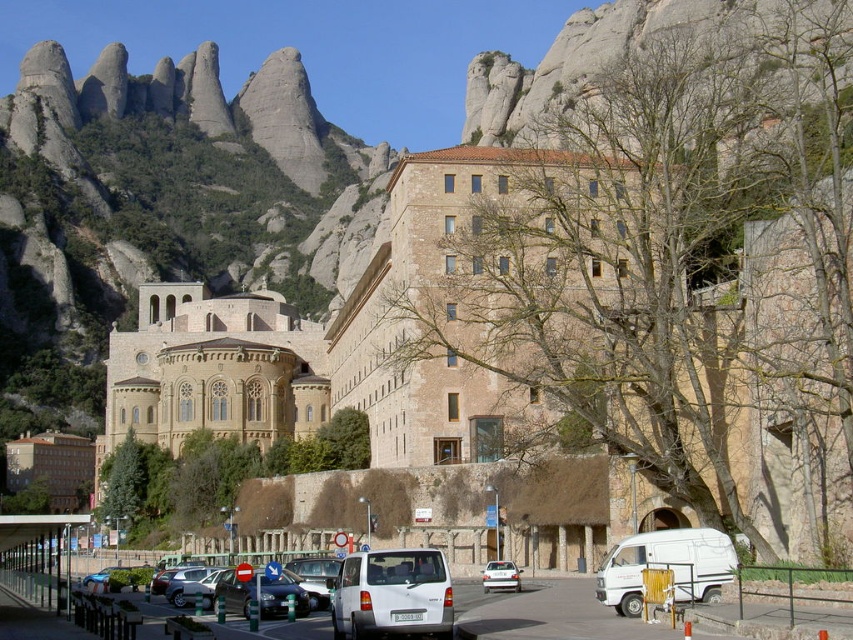
You are standing at the entrance of the monastery and want to locate the shiny blue sedan at center. According to the coordinates provided, where would you find it?

The shiny blue sedan at center is located at coordinates point (260, 595).

You are a tour guide explaining the monastery to visitors. You point out two sedans in the parking lot. One is a shiny blue sedan at center and the other is a metallic blue sedan at center. Which one is smaller in size?

The shiny blue sedan at center is smaller in size compared to the metallic blue sedan at center.

You are a delivery driver who needs to exit the parking area in front of the large stone building. You see the white matte van at center and the shiny blue sedan at center. Which vehicle should you move around to exit the parking area?

The white matte van at center is in front of the shiny blue sedan at center, so you should move around the shiny blue sedan at center to exit the parking area since it is behind the van.